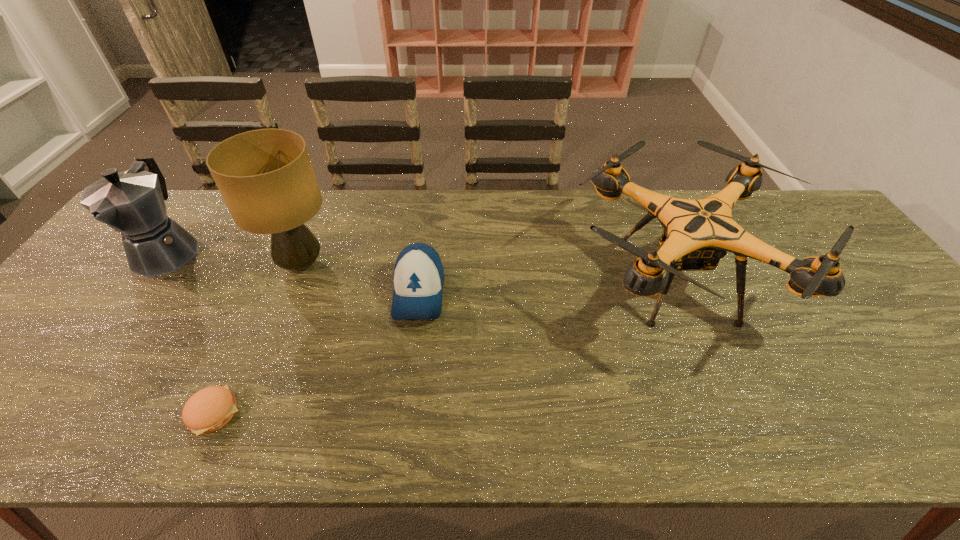
Where is `vacant space that satisfies the following two spatial constraints: 1. on the back side of the tallest object; 2. on the right side of the shortest object`? This screenshot has width=960, height=540. vacant space that satisfies the following two spatial constraints: 1. on the back side of the tallest object; 2. on the right side of the shortest object is located at coordinates click(281, 264).

At what (x,y) coordinates should I click in order to perform the action: click on free spot that satisfies the following two spatial constraints: 1. at the spout of the nearest object; 2. on the left side of the coffeepot. Please return your answer as a coordinate pair (x, y). Looking at the image, I should click on (51, 413).